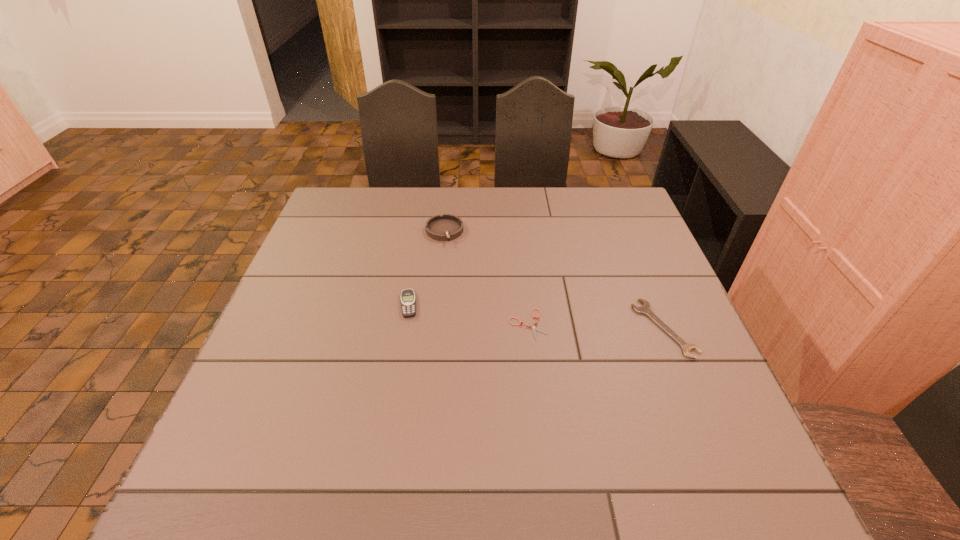
Find the location of a particular element. The width and height of the screenshot is (960, 540). object that is the second closest to the tallest object is located at coordinates (534, 328).

Select which object is the closest to the beeper. Please provide its 2D coordinates. Your answer should be formatted as a tuple, i.e. [(x, y)], where the tuple contains the x and y coordinates of a point satisfying the conditions above.

[(446, 227)]